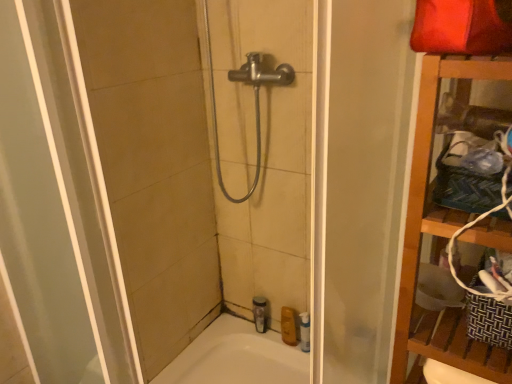
Question: Does point (396, 345) appear closer or farther from the camera than point (286, 306)?

Choices:
 (A) farther
 (B) closer

Answer: (B)

Question: Is wooden shelf at right taller or shorter than yellow matte bottle at lower center, arranged as the first toiletry when viewed from the right?

Choices:
 (A) short
 (B) tall

Answer: (B)

Question: Which of these objects is positioned farthest from the yellow matte bottle at lower center, arranged as the first toiletry when viewed from the right?

Choices:
 (A) clear plastic bottle at lower center, which is the second toiletry from right to left
 (B) wooden shelf at right
 (C) transparent plastic shower door at center
 (D) white glossy bathtub at lower center

Answer: (B)

Question: Which is nearer to the clear plastic bottle at lower center, the 1th toiletry from the left?

Choices:
 (A) yellow matte bottle at lower center, arranged as the first toiletry when viewed from the right
 (B) wooden shelf at right
 (C) white glossy bathtub at lower center
 (D) transparent plastic shower door at center

Answer: (A)